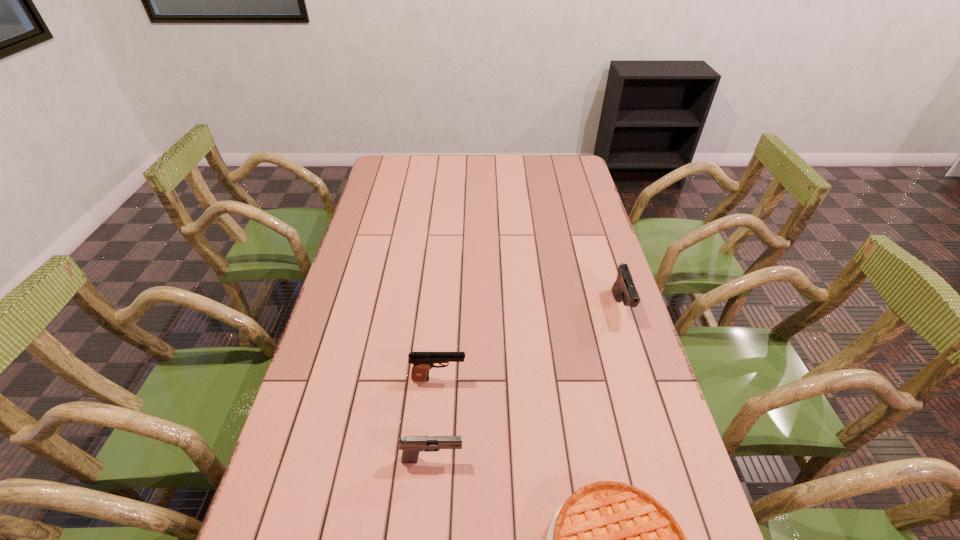
Where is `the second closest pistol to the nearest pistol`? the second closest pistol to the nearest pistol is located at coordinates (624, 290).

Find the location of `vacant space that satisfies the following two spatial constraints: 1. at the barrel of the rightmost pistol; 2. at the barrel of the second nearest pistol`. vacant space that satisfies the following two spatial constraints: 1. at the barrel of the rightmost pistol; 2. at the barrel of the second nearest pistol is located at coordinates (644, 379).

The width and height of the screenshot is (960, 540). I want to click on free space that satisfies the following two spatial constraints: 1. at the barrel of the rightmost pistol; 2. at the barrel of the second farthest object, so click(644, 379).

You are a GUI agent. You are given a task and a screenshot of the screen. Output one action in this format:
    pyautogui.click(x=<x>, y=<y>)
    Task: Click on the vacant region that satisfies the following two spatial constraints: 1. at the barrel of the farthest object; 2. aim along the barrel of the second nearest object
    Image resolution: width=960 pixels, height=540 pixels.
    Given the screenshot: What is the action you would take?
    pyautogui.click(x=670, y=459)

The width and height of the screenshot is (960, 540). Identify the location of vacant space that satisfies the following two spatial constraints: 1. at the barrel of the rightmost object; 2. at the barrel of the second farthest object. (644, 379).

Locate an element on the screen. This screenshot has height=540, width=960. vacant area that satisfies the following two spatial constraints: 1. at the barrel of the rightmost pistol; 2. aim along the barrel of the nearest pistol is located at coordinates (670, 459).